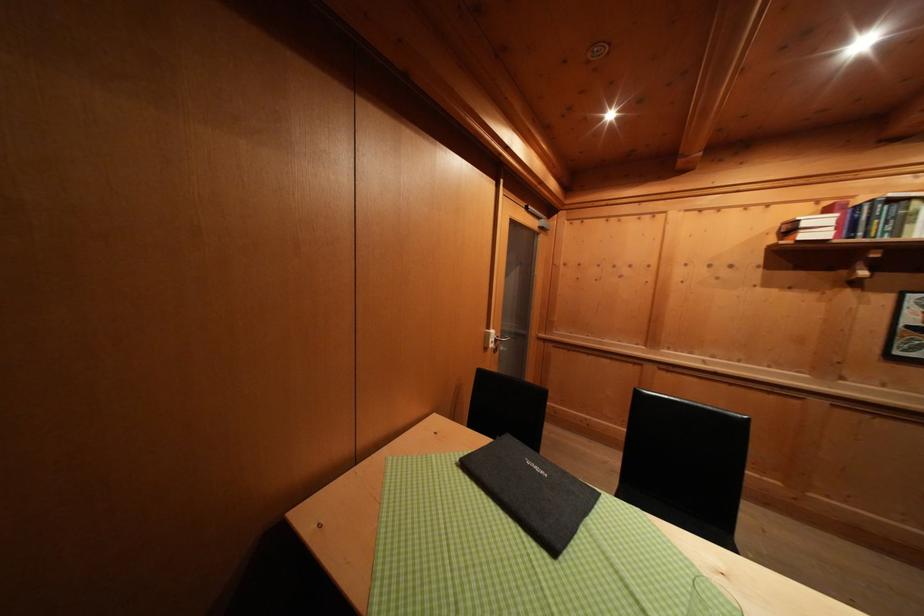
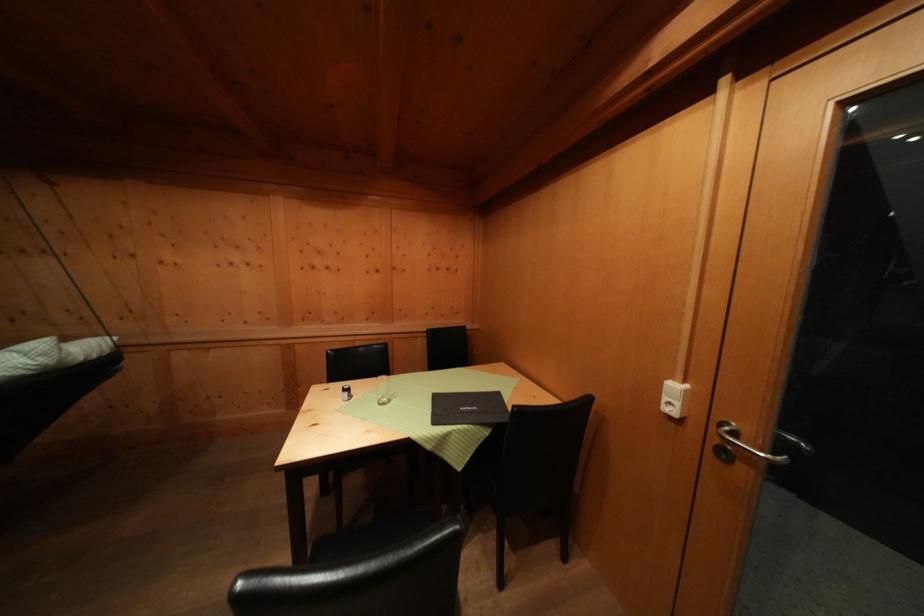
Where in the second image is the point corresponding to the point at 496,345 from the first image?

(672, 403)